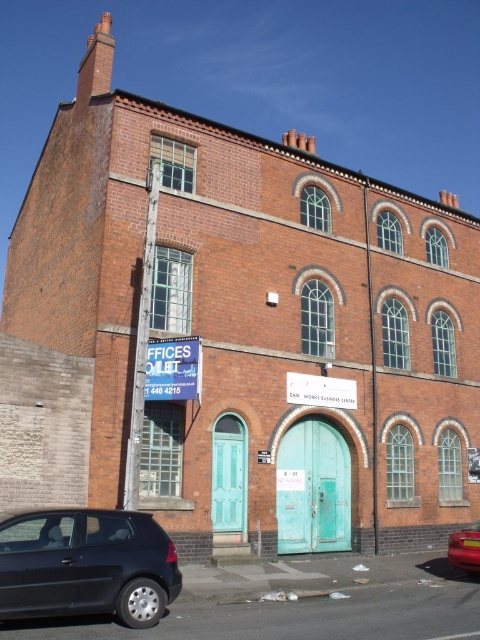
Is matte black hatchback at lower left closer to the viewer compared to metallic red car at lower right?

Yes, matte black hatchback at lower left is closer to the viewer.

Can you confirm if matte black hatchback at lower left is positioned to the left of metallic red car at lower right?

Indeed, matte black hatchback at lower left is positioned on the left side of metallic red car at lower right.

Identify the location of matte black hatchback at lower left. The height and width of the screenshot is (640, 480). (85, 564).

In order to click on matte black hatchback at lower left in this screenshot , I will do `click(85, 564)`.